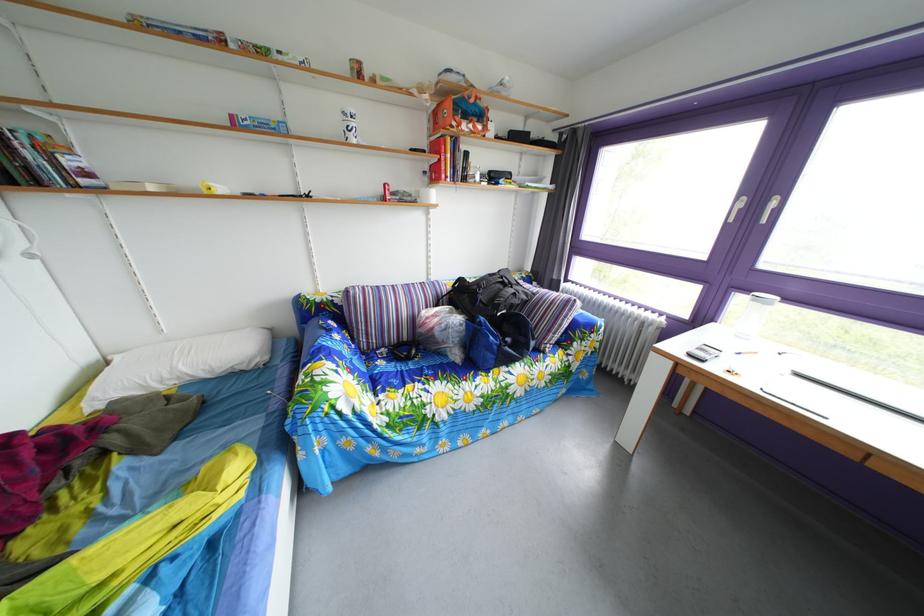
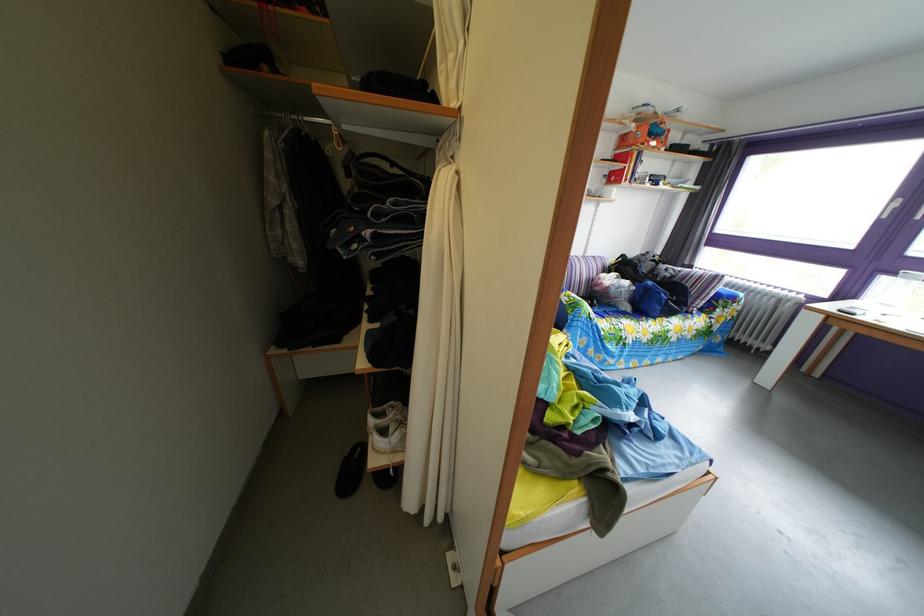
Find the pixel in the second image that matches pixel 467 363 in the first image.

(638, 315)